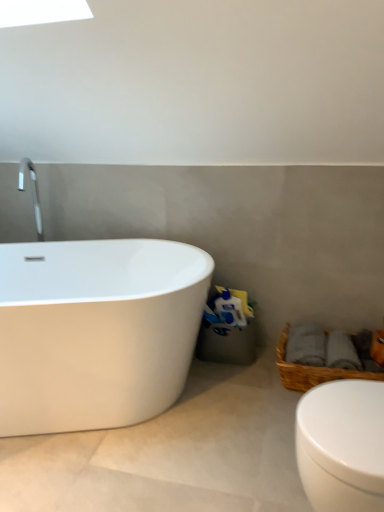
Question: Considering the positions of white glossy bathtub at left and white glossy toilet at lower right in the image, is white glossy bathtub at left wider or thinner than white glossy toilet at lower right?

Choices:
 (A) thin
 (B) wide

Answer: (B)

Question: Would you say white glossy bathtub at left is to the left or to the right of white glossy toilet at lower right in the picture?

Choices:
 (A) left
 (B) right

Answer: (A)

Question: Estimate the real-world distances between objects in this image. Which object is closer to the white glossy toilet at lower right?

Choices:
 (A) woven brown basket at lower right
 (B) white glossy bathtub at left

Answer: (A)

Question: Which is farther from the white glossy toilet at lower right?

Choices:
 (A) white glossy bathtub at left
 (B) woven brown basket at lower right

Answer: (A)